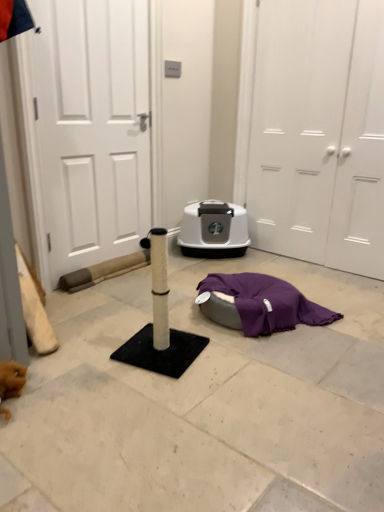
Question: Can you confirm if white textured scratching post at center is positioned to the right of white matte door at left, acting as the first door starting from the left?

Choices:
 (A) no
 (B) yes

Answer: (B)

Question: Can you confirm if white textured scratching post at center is shorter than white matte door at left, the 3th door from the right?

Choices:
 (A) no
 (B) yes

Answer: (B)

Question: Considering the relative sizes of white textured scratching post at center and white matte door at left, the 3th door from the right, in the image provided, is white textured scratching post at center smaller than white matte door at left, the 3th door from the right,?

Choices:
 (A) yes
 (B) no

Answer: (B)

Question: Can you confirm if white textured scratching post at center is bigger than white matte door at left, acting as the first door starting from the left?

Choices:
 (A) no
 (B) yes

Answer: (B)

Question: Is white textured scratching post at center looking in the opposite direction of white matte door at left, the 3th door from the right?

Choices:
 (A) yes
 (B) no

Answer: (B)

Question: Do you think white matte door at right, which appears as the 3th door when viewed from the left, is within white matte door at left, the 3th door from the right, or outside of it?

Choices:
 (A) outside
 (B) inside

Answer: (A)

Question: Relative to white matte door at left, acting as the first door starting from the left, is white matte door at right, which appears as the 3th door when viewed from the left, in front or behind?

Choices:
 (A) behind
 (B) front

Answer: (A)

Question: From a real-world perspective, is white matte door at right, which appears as the 3th door when viewed from the left, above or below white matte door at left, acting as the first door starting from the left?

Choices:
 (A) below
 (B) above

Answer: (A)

Question: From the image's perspective, is white matte door at right, which appears as the 3th door when viewed from the left, positioned above or below white matte door at left, acting as the first door starting from the left?

Choices:
 (A) below
 (B) above

Answer: (A)

Question: Which is correct: white matte door at right, which appears as the 3th door when viewed from the left, is inside white matte door at center, which appears as the second door when viewed from the left, or outside of it?

Choices:
 (A) inside
 (B) outside

Answer: (A)

Question: Is white matte door at right, the first door from the right, wider or thinner than white matte door at center, the 2th door from the right?

Choices:
 (A) wide
 (B) thin

Answer: (B)

Question: From a real-world perspective, is white matte door at right, the first door from the right, above or below white matte door at center, the 2th door from the right?

Choices:
 (A) below
 (B) above

Answer: (A)

Question: In terms of size, does white matte door at right, the first door from the right, appear bigger or smaller than white matte door at center, which appears as the second door when viewed from the left?

Choices:
 (A) small
 (B) big

Answer: (A)

Question: Considering the positions of purple fabric at lower center and white matte door at left, acting as the first door starting from the left, in the image, is purple fabric at lower center taller or shorter than white matte door at left, acting as the first door starting from the left,?

Choices:
 (A) tall
 (B) short

Answer: (B)

Question: In the image, is purple fabric at lower center on the left side or the right side of white matte door at left, acting as the first door starting from the left?

Choices:
 (A) right
 (B) left

Answer: (A)